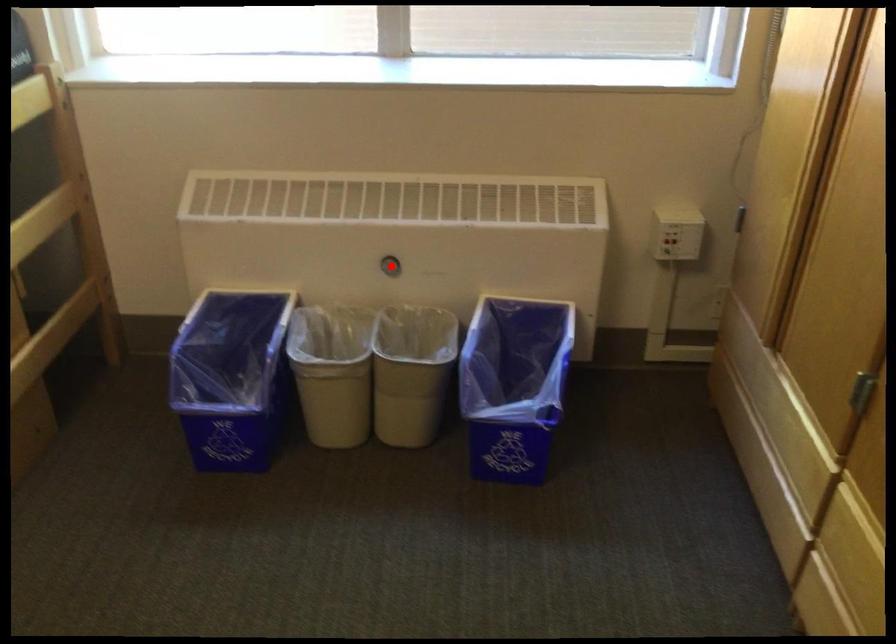
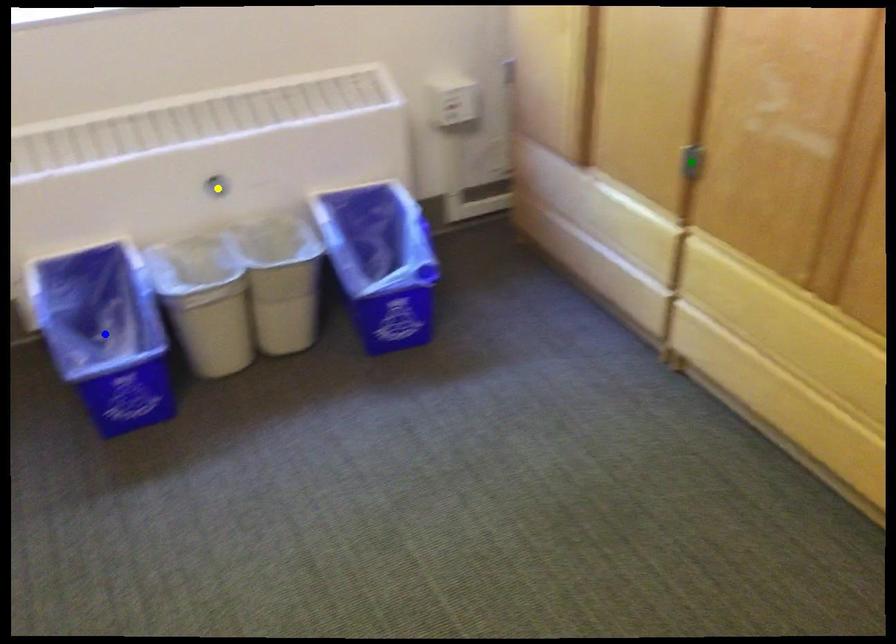
Question: I am providing you with two images of the same scene from different viewpoints. A red point is marked on the first image. You are given multiple points on the second image. In image 2, which mark is for the same physical point as the one in image 1?

Choices:
 (A) blue point
 (B) yellow point
 (C) green point

Answer: (B)